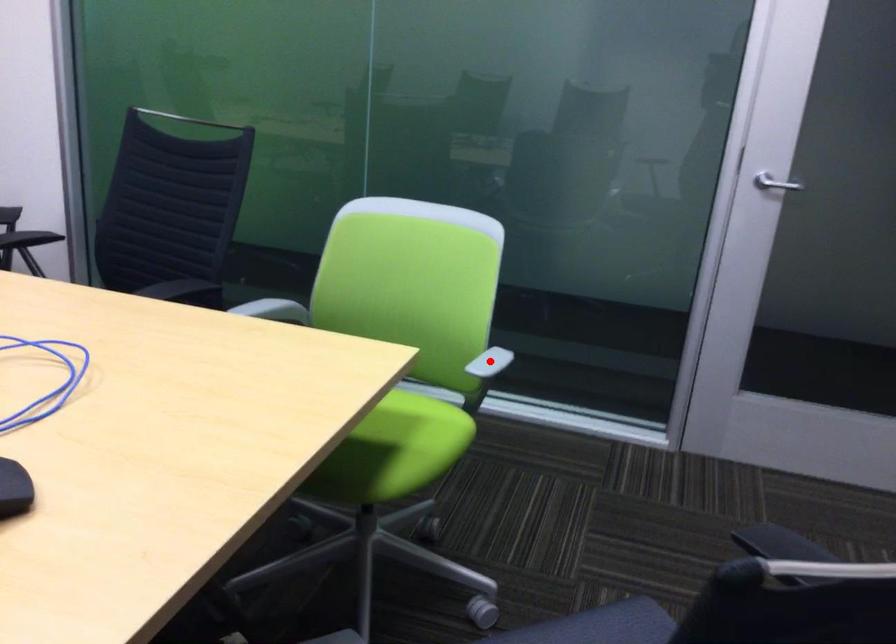
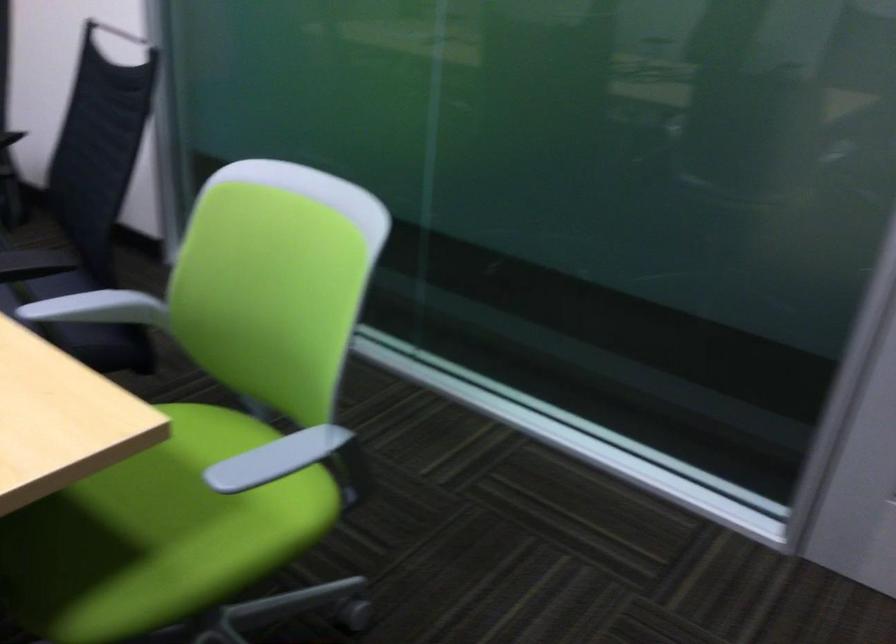
Find the pixel in the second image that matches the highlighted location in the first image.

(276, 458)